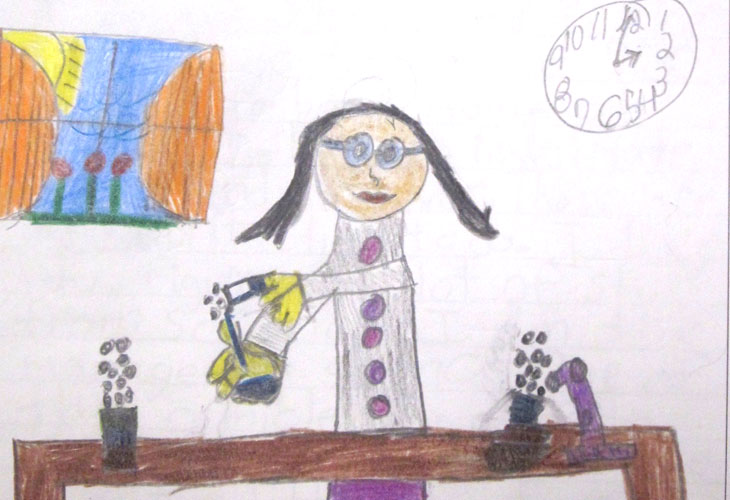
Locate an element on the screen. This screenshot has height=500, width=730. big hand - clock is located at coordinates (623, 31).